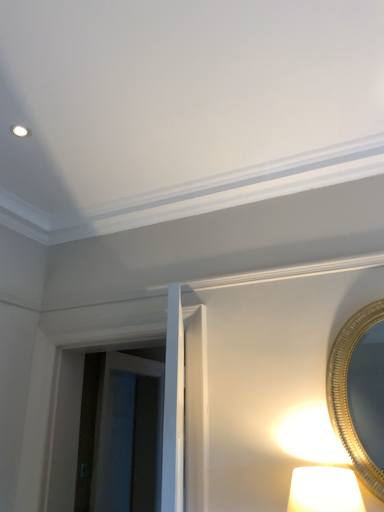
Question: Is point (367, 419) closer or farther from the camera than point (119, 374)?

Choices:
 (A) farther
 (B) closer

Answer: (B)

Question: Considering the positions of gold metallic mirror at right and transparent glass door at center in the image, is gold metallic mirror at right taller or shorter than transparent glass door at center?

Choices:
 (A) short
 (B) tall

Answer: (A)

Question: In terms of width, does gold metallic mirror at right look wider or thinner when compared to transparent glass door at center?

Choices:
 (A) wide
 (B) thin

Answer: (B)

Question: Looking at the image, does transparent glass door at center seem bigger or smaller compared to gold metallic mirror at right?

Choices:
 (A) small
 (B) big

Answer: (B)

Question: In terms of width, does transparent glass door at center look wider or thinner when compared to gold metallic mirror at right?

Choices:
 (A) wide
 (B) thin

Answer: (A)

Question: From their relative heights in the image, would you say transparent glass door at center is taller or shorter than gold metallic mirror at right?

Choices:
 (A) short
 (B) tall

Answer: (B)

Question: Is point (89, 442) closer or farther from the camera than point (375, 410)?

Choices:
 (A) closer
 (B) farther

Answer: (B)